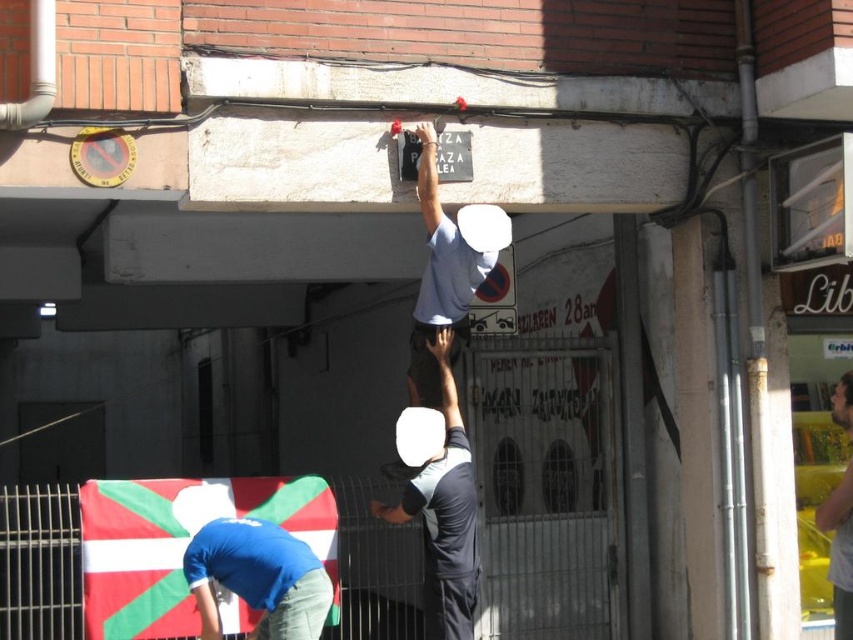
Question: Which object is closer to the camera taking this photo?

Choices:
 (A) light blue fabric shirt at upper center
 (B) dark gray fabric shirt at upper center
 (C) green and white fabric flag at lower left
 (D) light brown wooden board at upper right

Answer: (D)

Question: Which point is closer to the camera?

Choices:
 (A) dark gray fabric shirt at upper center
 (B) light brown wooden board at upper right
 (C) light blue fabric shirt at upper center
 (D) green and white fabric flag at lower left

Answer: (B)

Question: Which point is closer to the camera?

Choices:
 (A) green and white fabric flag at lower left
 (B) light brown wooden board at upper right
 (C) dark gray fabric shirt at upper center

Answer: (B)

Question: Does dark gray fabric shirt at upper center have a greater width compared to light blue fabric shirt at upper center?

Choices:
 (A) no
 (B) yes

Answer: (B)

Question: In this image, where is green and white fabric flag at lower left located relative to light blue fabric shirt at upper center?

Choices:
 (A) below
 (B) above

Answer: (A)

Question: In this image, where is green and white fabric flag at lower left located relative to light blue fabric shirt at upper center?

Choices:
 (A) below
 (B) above

Answer: (A)